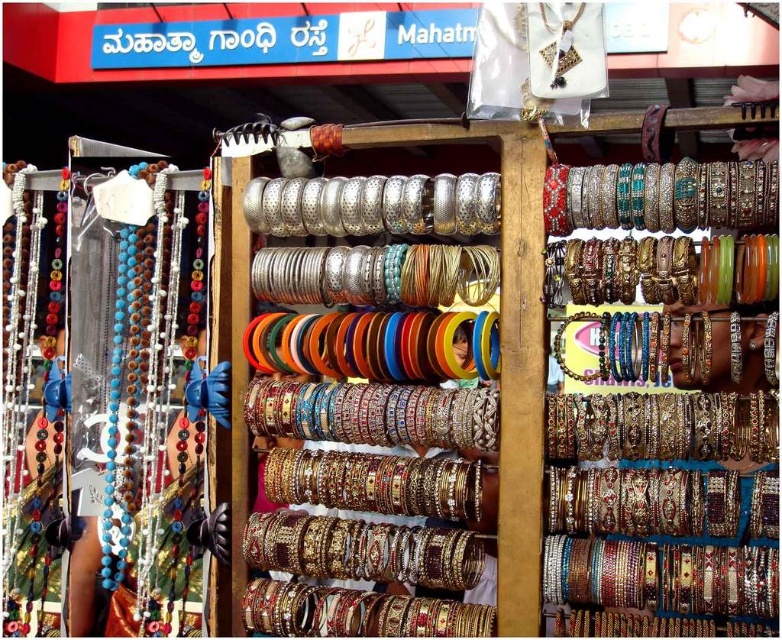
You are standing in front of the jewelry stall and see two points marked in the image. The first point is at coordinates point (666, 320) and the second is at point (467, 596). Which point is closer to you?

Point (666, 320) is in front of point (467, 596), so the first point is closer to you.

You are a customer at the jewelry stall and want to choose between the matte glass beads at left and the multicolored beaded bangles at center. Which option has bigger beads?

The matte glass beads at left has larger beads than the multicolored beaded bangles at center.

You are a customer at the jewelry stall and want to buy a necklace and bangles. You notice the matte glass beads at left and the multicolored beaded bangles at center. Which item is positioned lower in the display?

The matte glass beads at left are positioned lower than the multicolored beaded bangles at center.